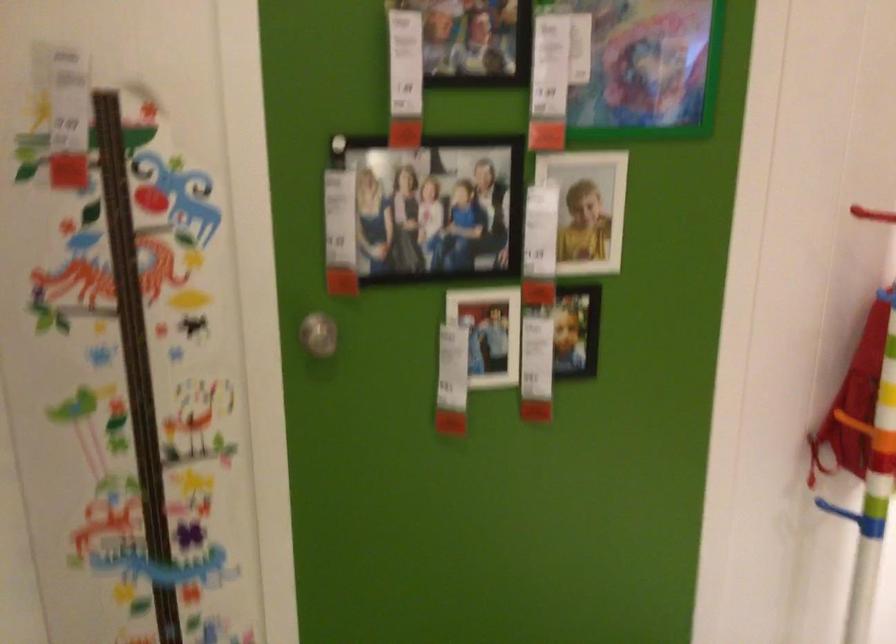
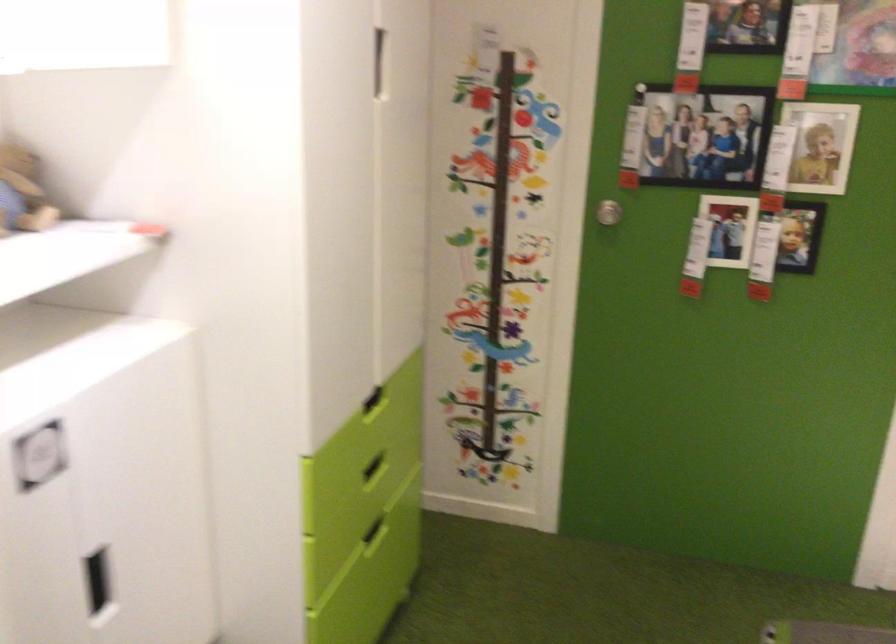
Find the pixel in the second image that matches point 317,337 in the first image.

(607, 212)